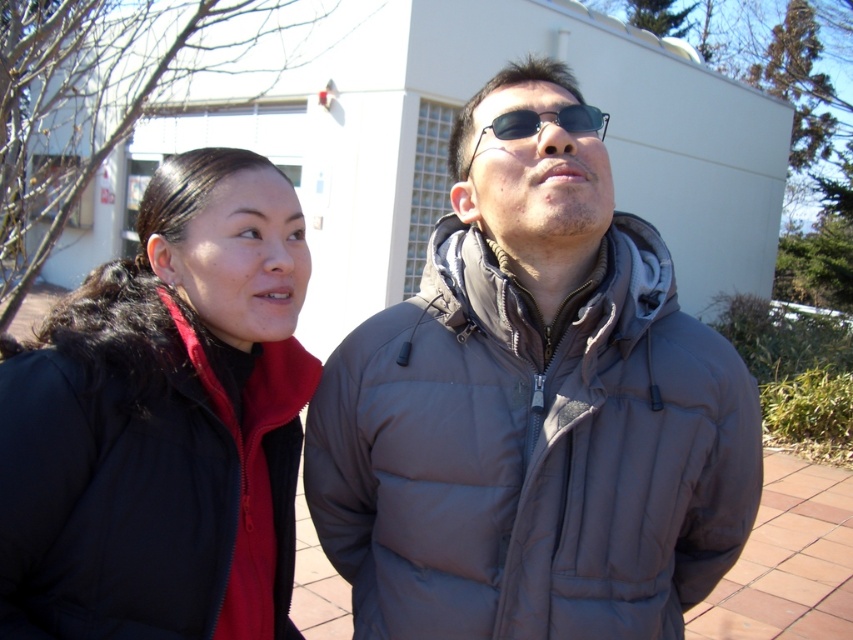
Question: Is gray puffy jacket at center bigger than black plastic sunglasses at center?

Choices:
 (A) yes
 (B) no

Answer: (A)

Question: Which point is closer to the camera taking this photo?

Choices:
 (A) (351, 400)
 (B) (309, 385)

Answer: (A)

Question: Which point is farther from the camera taking this photo?

Choices:
 (A) pyautogui.click(x=514, y=118)
 (B) pyautogui.click(x=223, y=534)
 (C) pyautogui.click(x=488, y=195)

Answer: (C)

Question: Which object is closer to the camera taking this photo?

Choices:
 (A) black matte jacket at left
 (B) black plastic sunglasses at center

Answer: (A)

Question: Is gray puffy jacket at center wider than black matte jacket at left?

Choices:
 (A) yes
 (B) no

Answer: (A)

Question: Is black matte jacket at left below black plastic sunglasses at center?

Choices:
 (A) no
 (B) yes

Answer: (B)